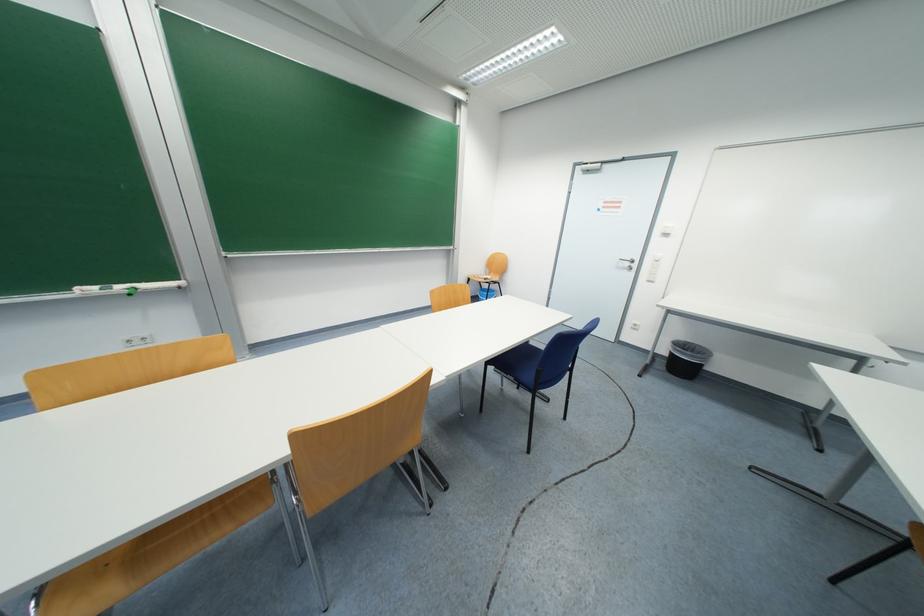
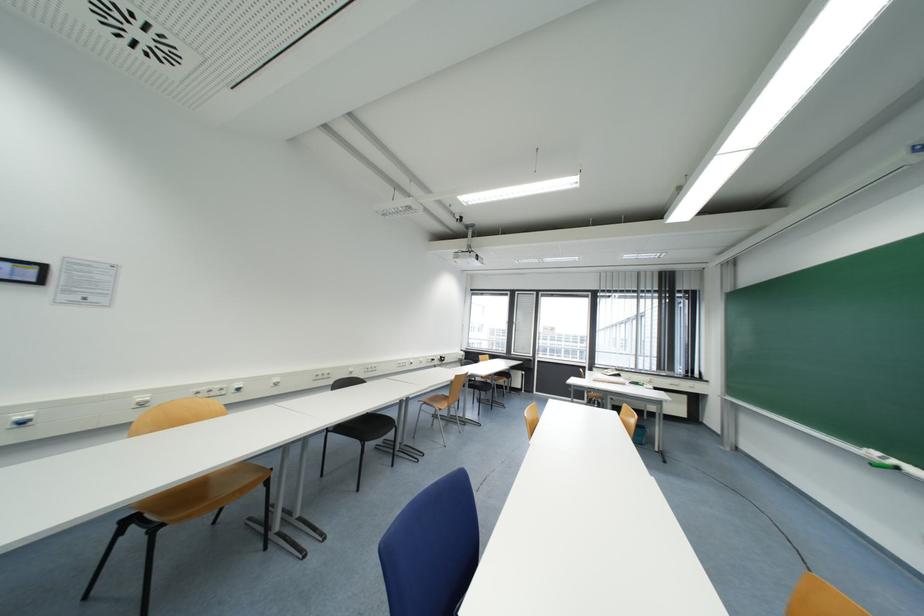
In the second image, find the point that corresponds to point (126, 289) in the first image.

(898, 464)